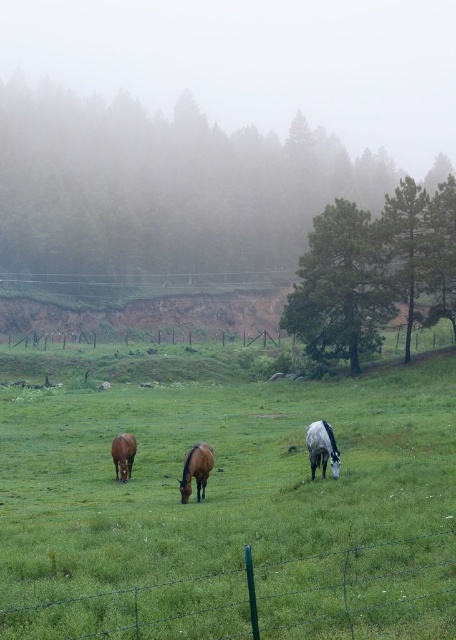
Question: Based on their relative distances, which object is nearer to the brown glossy horse at center?

Choices:
 (A) brown glossy horse at lower left
 (B) green grassy field at center

Answer: (A)

Question: Is green wire fence at lower center to the left of brown glossy horse at lower left from the viewer's perspective?

Choices:
 (A) no
 (B) yes

Answer: (A)

Question: Among these points, which one is nearest to the camera?

Choices:
 (A) (419, 593)
 (B) (420, 541)

Answer: (A)

Question: Estimate the real-world distances between objects in this image. Which object is closer to the green grassy field at center?

Choices:
 (A) white glossy horse at center
 (B) green wire fence at lower center
 (C) brown glossy horse at center

Answer: (B)

Question: Can you confirm if green grassy field at center is positioned to the right of brown glossy horse at lower left?

Choices:
 (A) no
 (B) yes

Answer: (B)

Question: Does green wire fence at lower center have a lesser width compared to brown glossy horse at lower left?

Choices:
 (A) yes
 (B) no

Answer: (B)